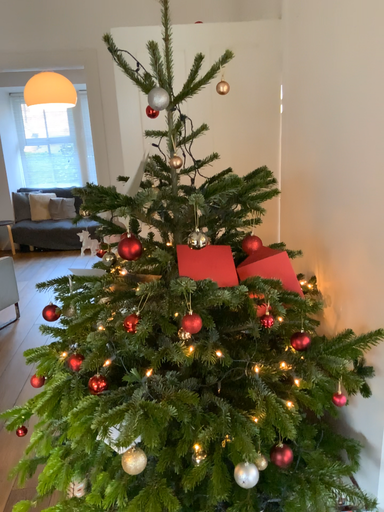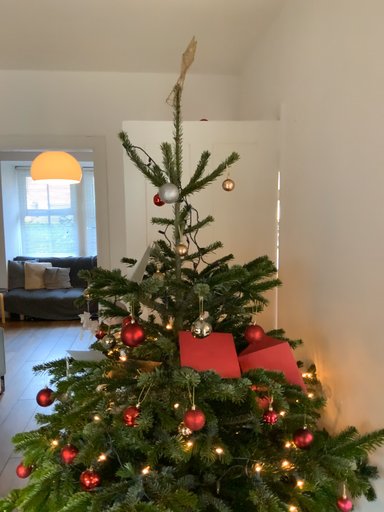
Question: Which way did the camera rotate in the video?

Choices:
 (A) rotated downward
 (B) rotated upward

Answer: (B)